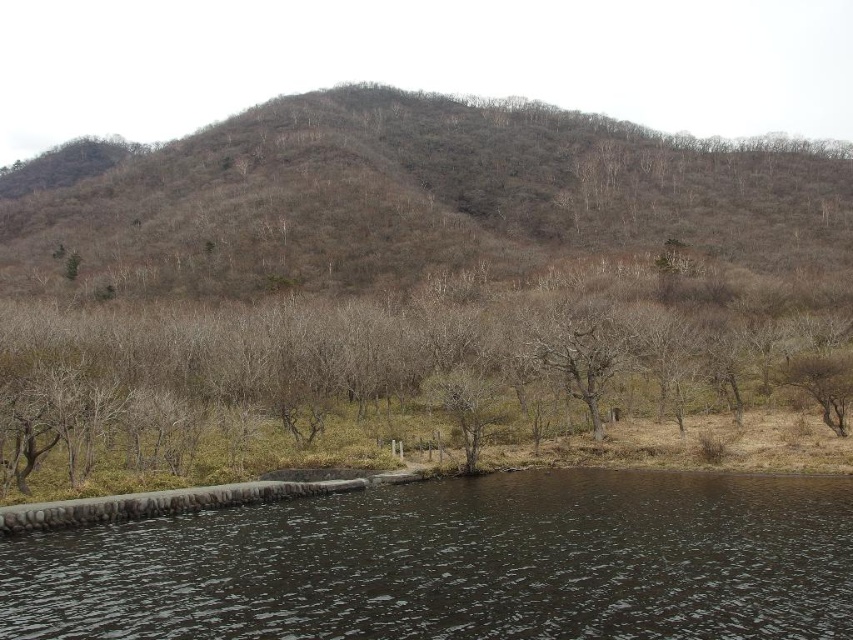
You are standing at the point labeled as point (457, 563). What is the terrain like at your current location?

The terrain at point (457, 563) is dark water at lower center, which is part of the serene natural landscape with a large, gently sloping hill covered with sparse vegetation.